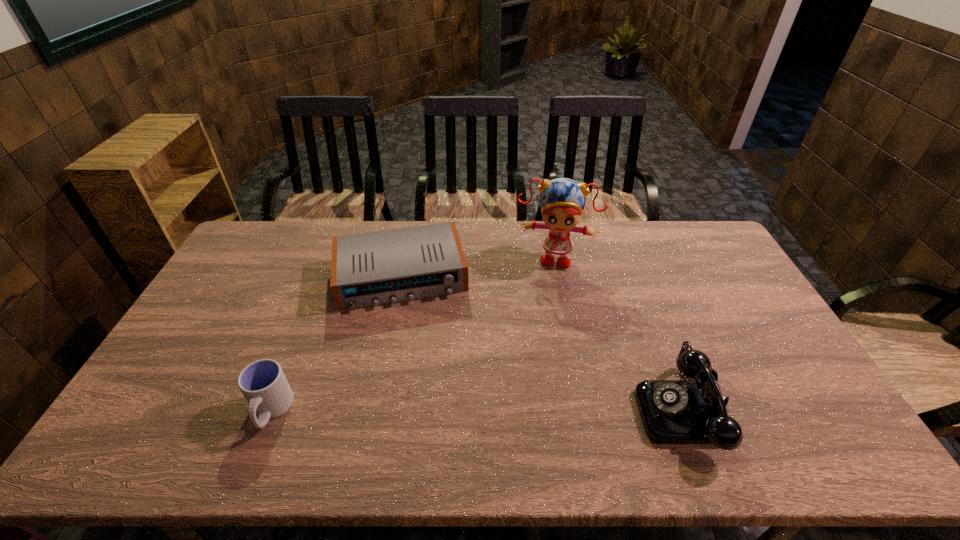
Locate an element on the screen. vacant space located on the face of the tallest object is located at coordinates pos(546,305).

This screenshot has height=540, width=960. What are the coordinates of `free point located 0.360m on the face of the tallest object` in the screenshot? It's located at (541, 351).

Image resolution: width=960 pixels, height=540 pixels. I want to click on free space located on the face of the tallest object, so click(x=545, y=316).

What are the coordinates of `radio receiver located at the far edge` in the screenshot? It's located at (373, 268).

You are a GUI agent. You are given a task and a screenshot of the screen. Output one action in this format:
    pyautogui.click(x=<x>, y=<y>)
    Task: Click on the doll positioned at the far edge
    This screenshot has height=540, width=960.
    Given the screenshot: What is the action you would take?
    pyautogui.click(x=561, y=200)

Image resolution: width=960 pixels, height=540 pixels. Identify the location of cup situated at the near edge. (263, 383).

Locate an element on the screen. telephone located in the near edge section of the desktop is located at coordinates (694, 411).

You are a GUI agent. You are given a task and a screenshot of the screen. Output one action in this format:
    pyautogui.click(x=<x>, y=<y>)
    Task: Click on the free space at the far edge of the desktop
    The width and height of the screenshot is (960, 540).
    Given the screenshot: What is the action you would take?
    pyautogui.click(x=423, y=226)

In the image, there is a desktop. Where is `free space at the right edge`? The height and width of the screenshot is (540, 960). free space at the right edge is located at coordinates (735, 321).

Locate an element on the screen. vacant area at the far left corner is located at coordinates (268, 224).